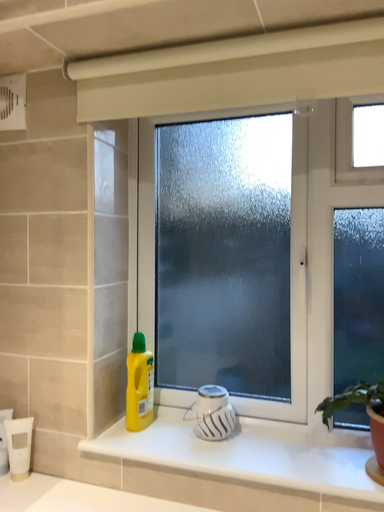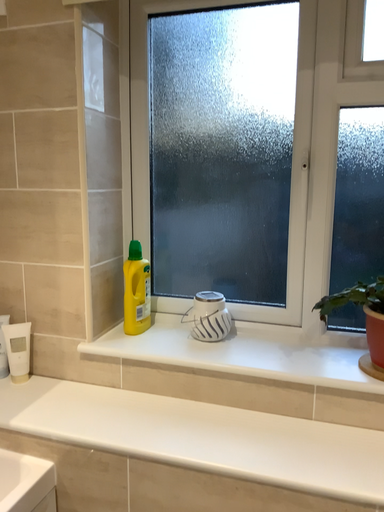
Question: Which way did the camera rotate in the video?

Choices:
 (A) rotated downward
 (B) rotated upward

Answer: (A)